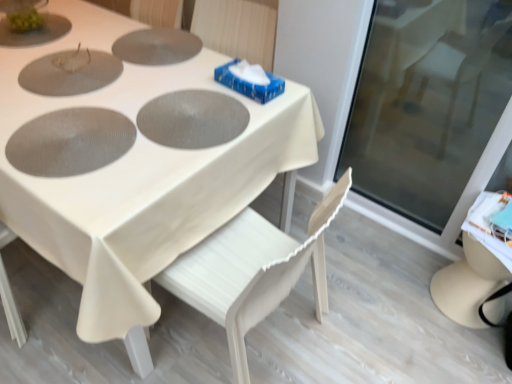
Find the location of a particular element. This screenshot has height=384, width=512. vacant area that lies between gray matte pizza pan at center, which is the second pizza pan in back-to-front order, and matte gray pizza pan at upper center, which is the 3th pizza pan from front to back is located at coordinates (166, 75).